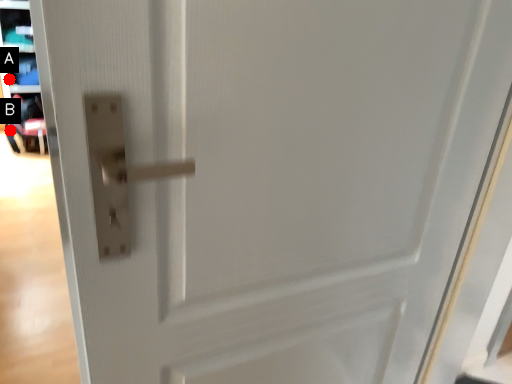
Question: Two points are circled on the image, labeled by A and B beside each circle. Which of the following is the farthest from the observer?

Choices:
 (A) A is further
 (B) B is further

Answer: (A)